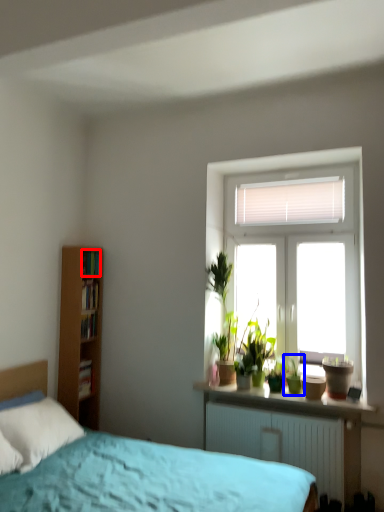
Question: Which point is further to the camera, book (highlighted by a red box) or houseplant (highlighted by a blue box)?

Choices:
 (A) book
 (B) houseplant

Answer: (A)